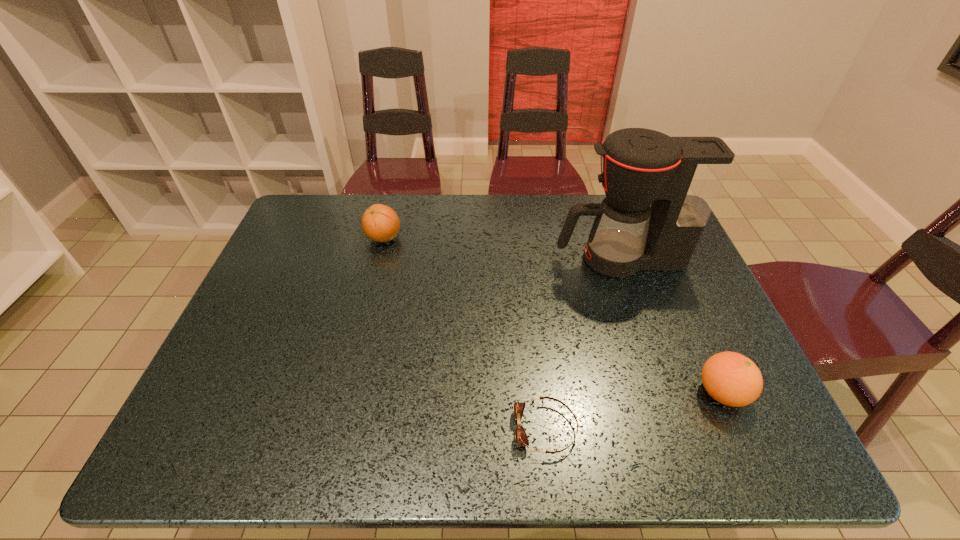
Identify the location of free space located on the left of the nearer orange. The width and height of the screenshot is (960, 540). (515, 393).

Locate an element on the screen. This screenshot has width=960, height=540. vacant space located 0.110m through the lenses of the third object from right to left is located at coordinates (462, 429).

The image size is (960, 540). Find the location of `vacant space located through the lenses of the third object from right to left`. vacant space located through the lenses of the third object from right to left is located at coordinates (350, 429).

Find the location of a particular element. This screenshot has height=540, width=960. free space located 0.180m through the lenses of the third object from right to left is located at coordinates (428, 429).

Find the location of `coffee maker that is at the far edge`. coffee maker that is at the far edge is located at coordinates (681, 177).

At what (x,y) coordinates should I click in order to perform the action: click on orange that is positioned at the far edge. Please return your answer as a coordinate pair (x, y). This screenshot has width=960, height=540. Looking at the image, I should click on (380, 223).

Locate an element on the screen. object that is at the near edge is located at coordinates (521, 438).

The height and width of the screenshot is (540, 960). Identify the location of coffee maker present at the right edge. (681, 177).

Where is `orange positioned at the right edge`? orange positioned at the right edge is located at coordinates (732, 379).

Locate an element on the screen. This screenshot has width=960, height=540. object situated at the far right corner is located at coordinates (681, 177).